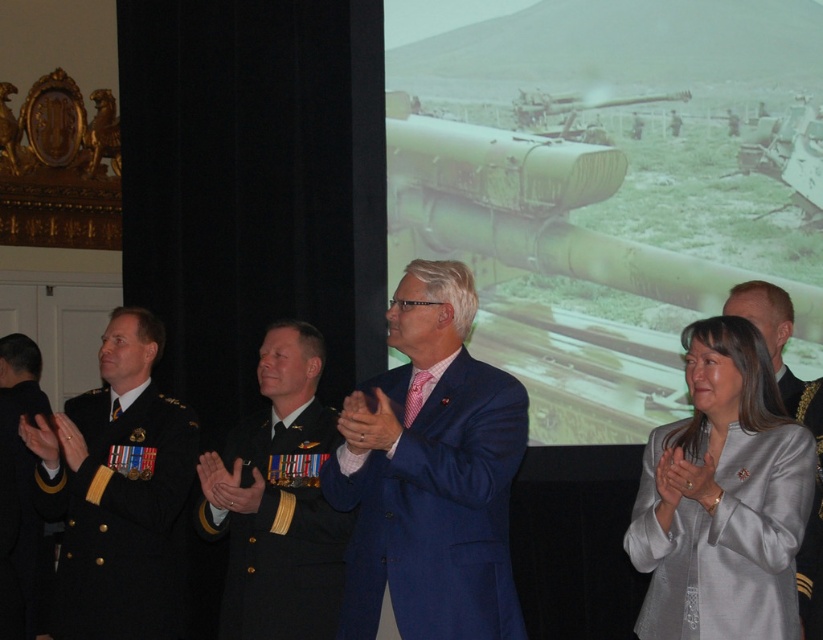
Question: Is black fabric uniform at right to the left of light brown uniform at center from the viewer's perspective?

Choices:
 (A) yes
 (B) no

Answer: (B)

Question: Is black wool military uniform at left in front of green matte tank at upper right?

Choices:
 (A) no
 (B) yes

Answer: (B)

Question: Can you confirm if black wool military uniform at left is thinner than light brown uniform at center?

Choices:
 (A) yes
 (B) no

Answer: (B)

Question: Which object is farther from the camera taking this photo?

Choices:
 (A) light brown uniform at center
 (B) black fabric uniform at right

Answer: (A)

Question: Estimate the real-world distances between objects in this image. Which object is farther from the blue satin suit at center?

Choices:
 (A) green matte tank at upper right
 (B) light brown uniform at center
 (C) black fabric uniform at right
 (D) navy blue fabric uniform at left

Answer: (A)

Question: Which object is positioned closest to the black fabric uniform at right?

Choices:
 (A) green matte tank at upper right
 (B) dark blue fabric uniform at center
 (C) silver satin blazer at lower right
 (D) navy blue fabric uniform at left

Answer: (C)